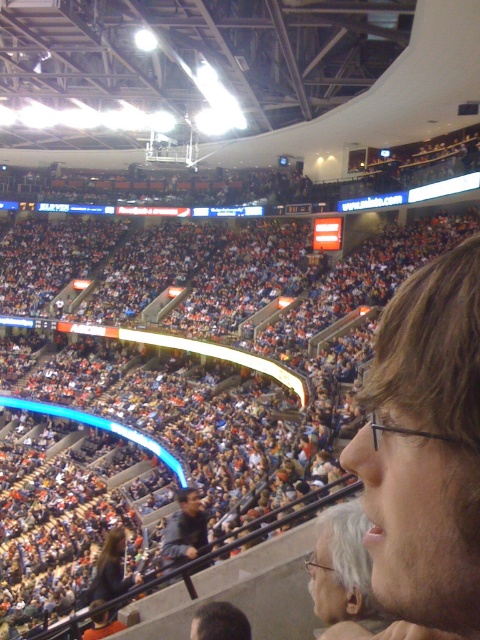
In the scene shown: Can you confirm if light brown hair at right is wider than dark gray jacket at center?

No.

Is light brown hair at right to the right of dark gray jacket at center from the viewer's perspective?

Correct, you'll find light brown hair at right to the right of dark gray jacket at center.

Does point (469, 323) come in front of point (179, 497)?

That is True.

This screenshot has height=640, width=480. What are the coordinates of `light brown hair at right` in the screenshot? It's located at (425, 448).